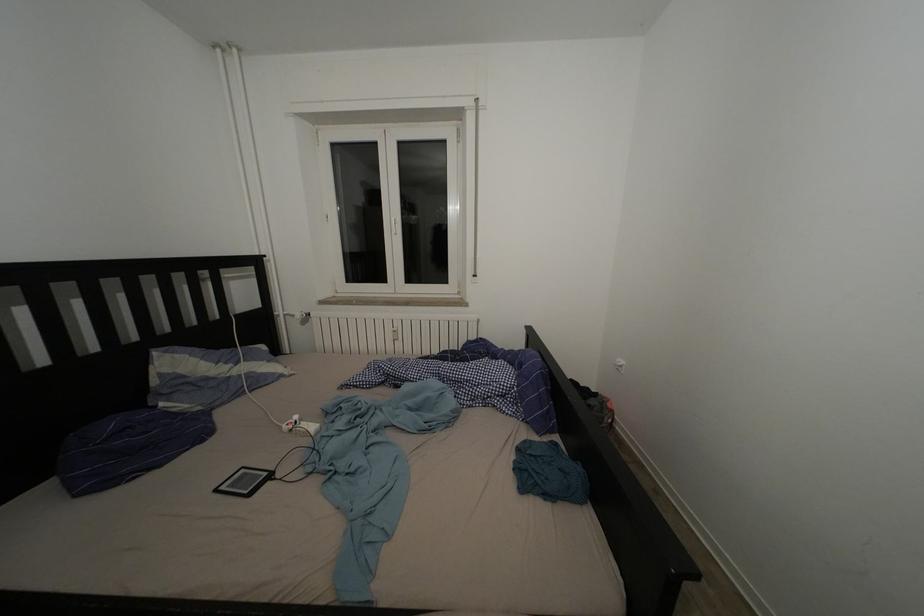
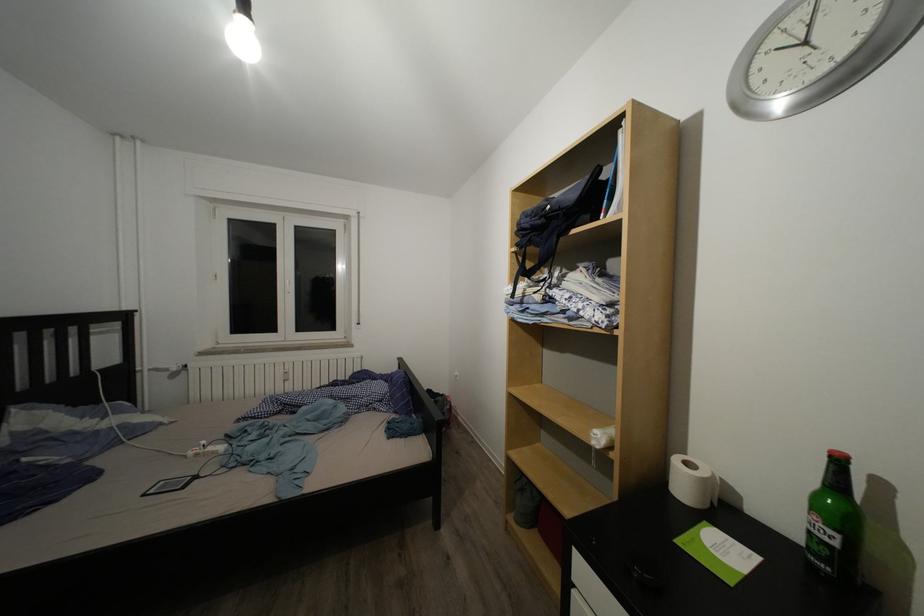
Question: Which direction would the cameraman need to move to produce the second image? Reply with the corresponding letter.

Choices:
 (A) Left
 (B) Right
 (C) Forward
 (D) Backward

Answer: (D)